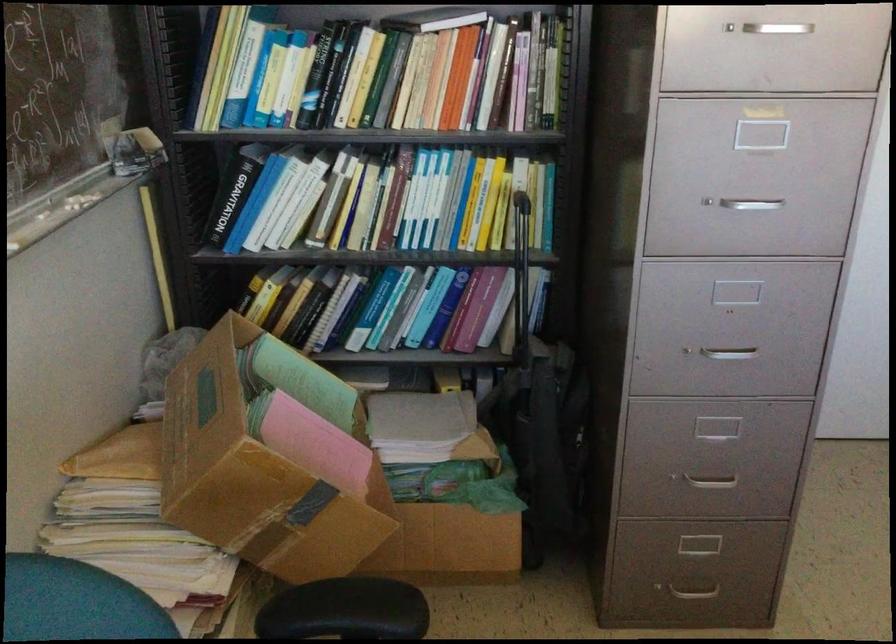
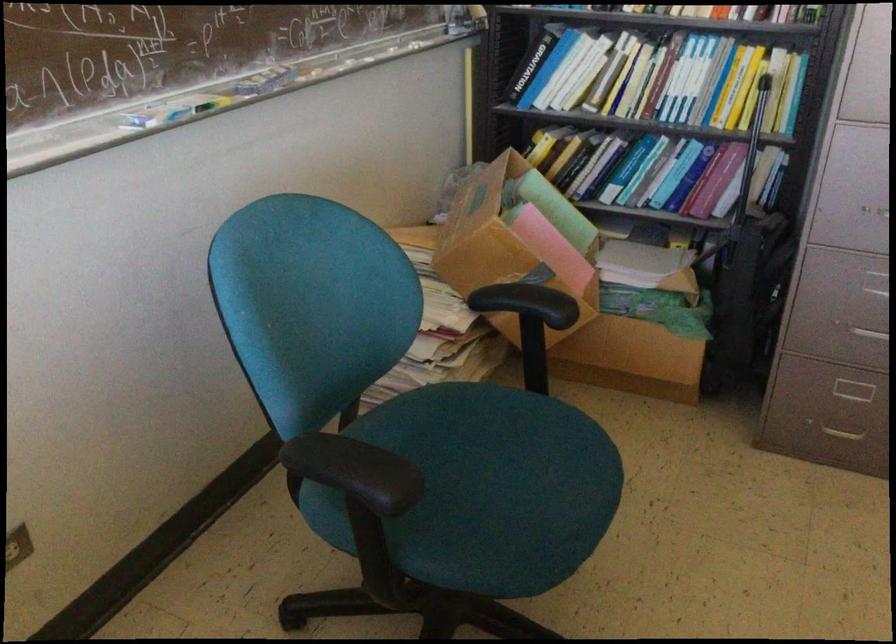
Where in the second image is the point corresponding to (x=302, y=210) from the first image?

(583, 77)